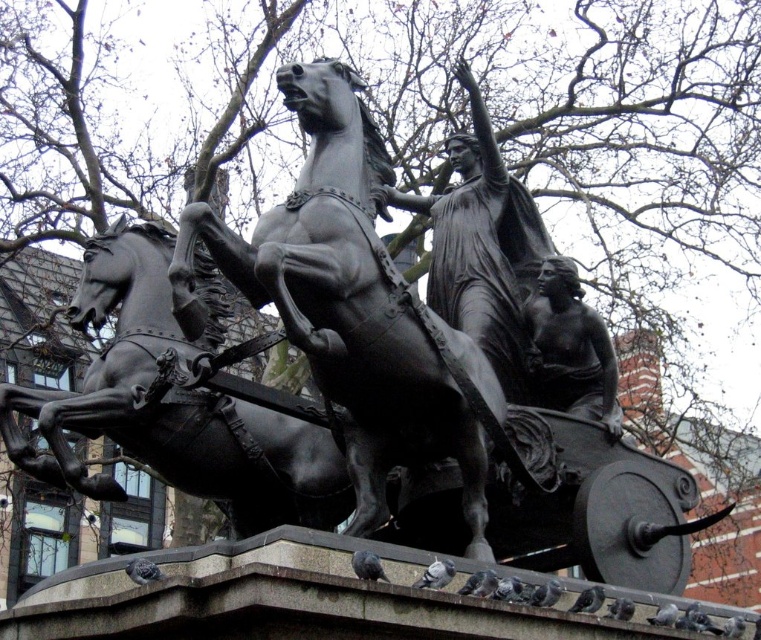
Question: Which object is closer to the camera taking this photo?

Choices:
 (A) polished bronze chariot at center
 (B) bronze statue at center
 (C) polished bronze horse at center

Answer: (A)

Question: Is polished bronze chariot at center thinner than polished bronze statue at center?

Choices:
 (A) no
 (B) yes

Answer: (A)

Question: Which point appears farthest from the camera in this image?

Choices:
 (A) (454, 458)
 (B) (594, 369)

Answer: (B)

Question: Does polished bronze chariot at center have a smaller size compared to polished bronze horse at center?

Choices:
 (A) yes
 (B) no

Answer: (B)

Question: Is polished bronze statue at center above bronze statue at center?

Choices:
 (A) yes
 (B) no

Answer: (A)

Question: Which object is closer to the camera taking this photo?

Choices:
 (A) polished bronze horse at center
 (B) bronze statue at center
 (C) polished bronze chariot at center

Answer: (C)